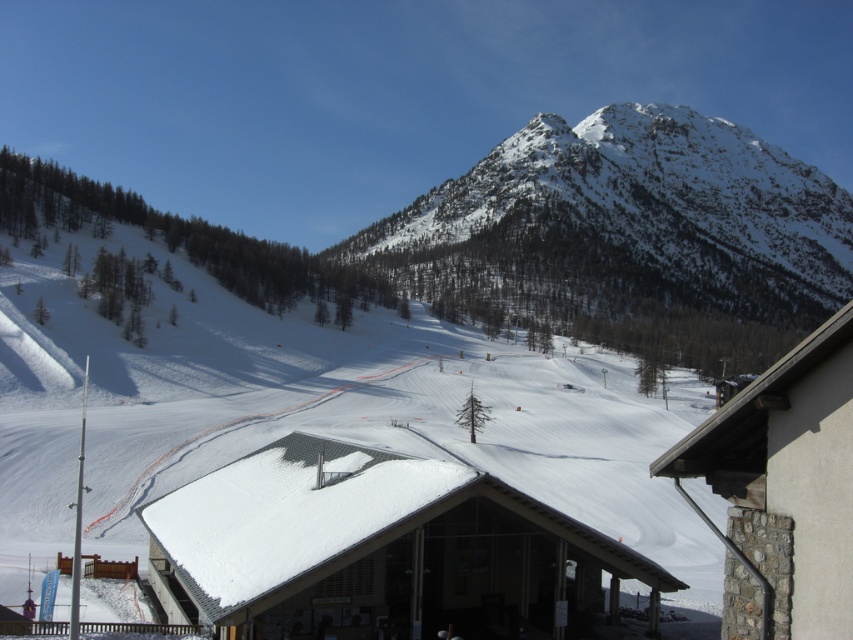
Question: Among these points, which one is farthest from the camera?

Choices:
 (A) (664, 173)
 (B) (399, 497)

Answer: (A)

Question: Does snowy rocky mountain at upper center have a larger size compared to white shingled roof at center?

Choices:
 (A) yes
 (B) no

Answer: (A)

Question: Is snowy rocky mountain at upper center further to camera compared to white shingled roof at center?

Choices:
 (A) yes
 (B) no

Answer: (A)

Question: Can you confirm if snowy rocky mountain at upper center is positioned to the left of white shingled roof at center?

Choices:
 (A) yes
 (B) no

Answer: (B)